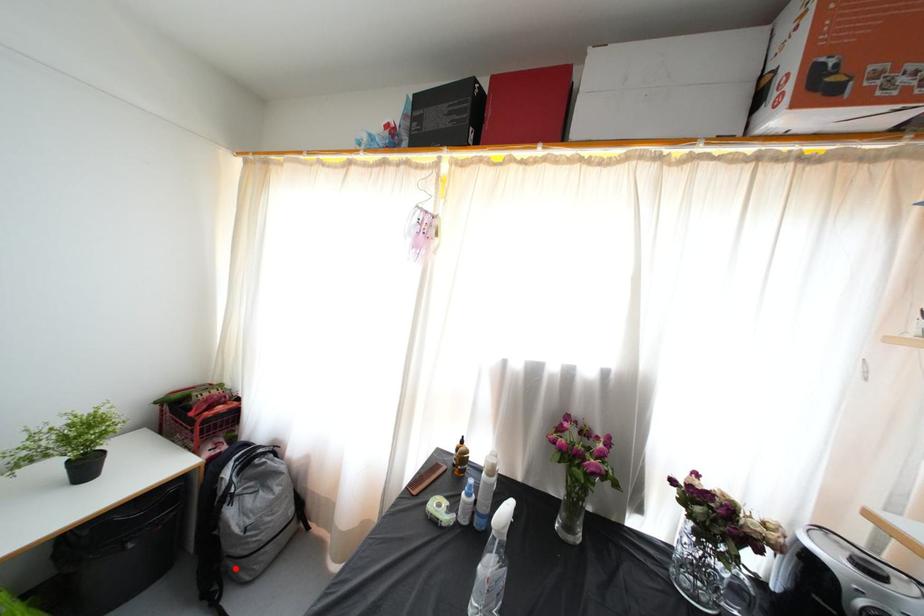
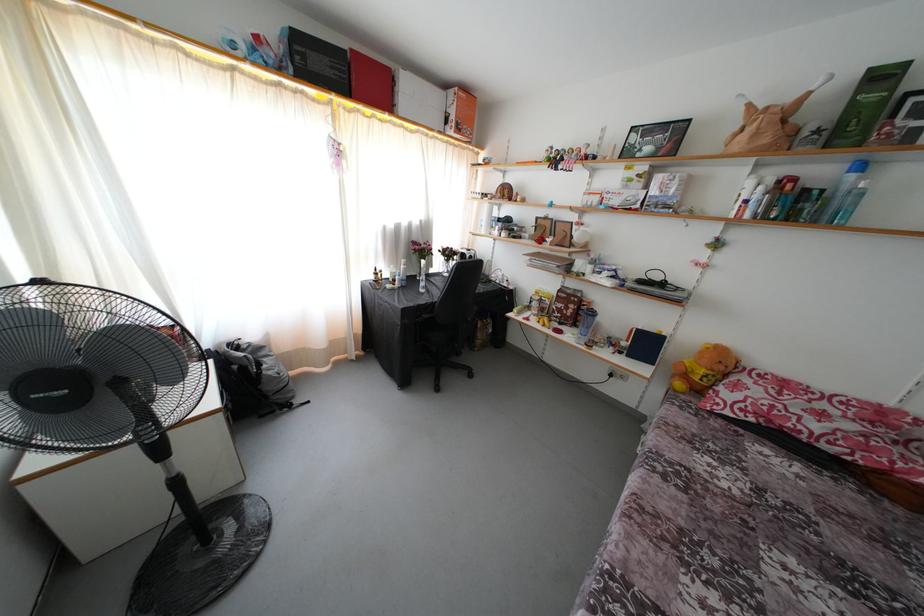
Question: I am providing you with two images of the same scene from different viewpoints. A red point is shown in image1. For the corresponding object point in image2, is it positioned nearer or farther from the camera?

Choices:
 (A) Nearer
 (B) Farther

Answer: (A)